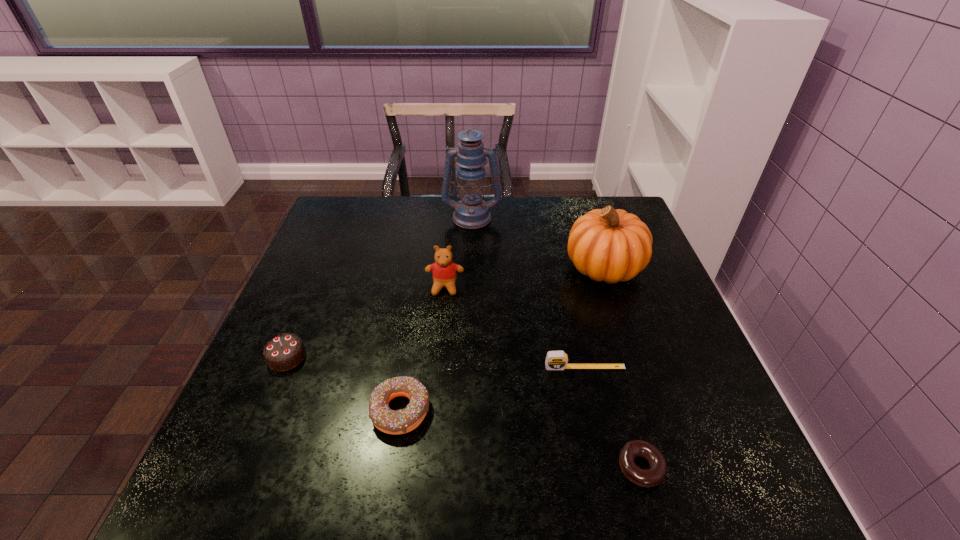
Find the location of a particular element. empty space between the right doughnut and the farthest object is located at coordinates (556, 342).

I want to click on vacant area that lies between the teddy bear and the farthest object, so click(458, 252).

Find the location of a particular element. object that is the sixth closest one to the chocolate cake is located at coordinates (654, 475).

Where is `object that ranks as the closest to the lantern`? object that ranks as the closest to the lantern is located at coordinates [609, 245].

You are a GUI agent. You are given a task and a screenshot of the screen. Output one action in this format:
    pyautogui.click(x=<x>, y=<y>)
    Task: Click on the free space in the image that satisfies the following two spatial constraints: 1. on the front-facing side of the teddy bear; 2. on the left side of the nearest object
    This screenshot has height=540, width=960.
    Given the screenshot: What is the action you would take?
    pyautogui.click(x=429, y=467)

Find the location of `vacant area that satisfies the following two spatial constraints: 1. on the back side of the second tallest object; 2. on the right side of the chocolate cake`. vacant area that satisfies the following two spatial constraints: 1. on the back side of the second tallest object; 2. on the right side of the chocolate cake is located at coordinates (324, 267).

This screenshot has width=960, height=540. What are the coordinates of `vacant position in the image that satisfies the following two spatial constraints: 1. on the front-facing side of the shortest object; 2. on the left side of the third tallest object` in the screenshot? It's located at (429, 467).

Locate an element on the screen. This screenshot has width=960, height=540. free spot that satisfies the following two spatial constraints: 1. on the front-facing side of the shorter doughnut; 2. on the left side of the fifth shortest object is located at coordinates (429, 467).

At what (x,y) coordinates should I click in order to perform the action: click on free location that satisfies the following two spatial constraints: 1. at the front of the shorter doughnut with the tape extended; 2. on the right side of the tape measure. Please return your answer as a coordinate pair (x, y). The width and height of the screenshot is (960, 540). Looking at the image, I should click on (607, 467).